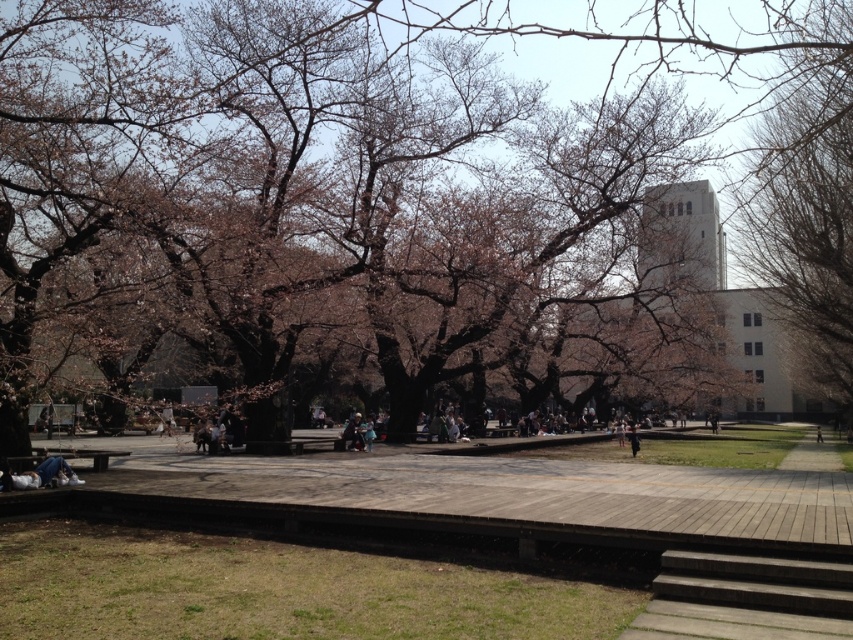
Question: Which point is farther to the camera?

Choices:
 (A) pink blossoms at center
 (B) bare branches at upper right

Answer: (B)

Question: Considering the relative positions of pink blossoms at center and bare branches at upper right in the image provided, where is pink blossoms at center located with respect to bare branches at upper right?

Choices:
 (A) left
 (B) right

Answer: (A)

Question: Does pink blossoms at center appear under bare branches at upper right?

Choices:
 (A) no
 (B) yes

Answer: (A)

Question: In this image, where is pink blossoms at center located relative to bare branches at upper right?

Choices:
 (A) above
 (B) below

Answer: (A)